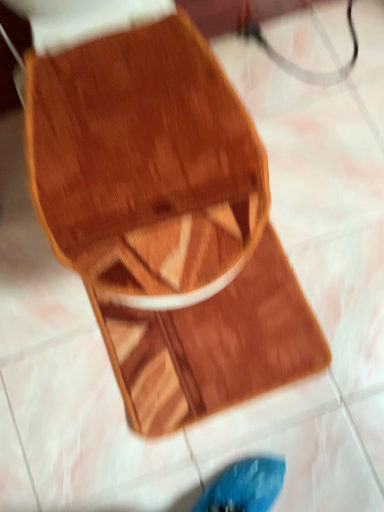
Where is `vacant space in front of wooden cutting board at center`? vacant space in front of wooden cutting board at center is located at coordinates (252, 456).